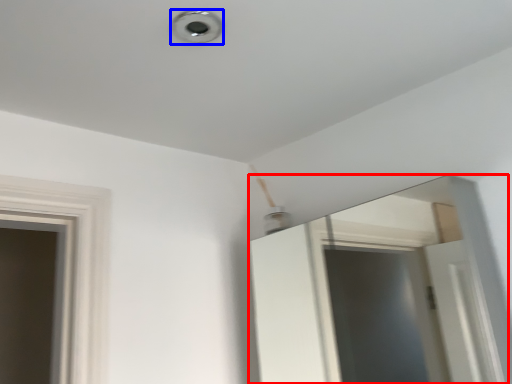
Question: Which point is further to the camera, mirror (highlighted by a red box) or light (highlighted by a blue box)?

Choices:
 (A) mirror
 (B) light

Answer: (B)